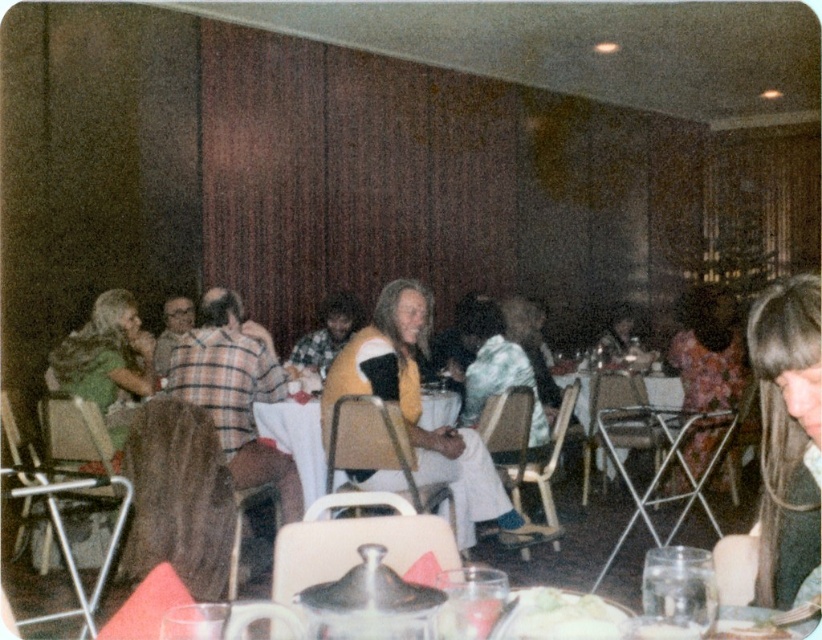
You are a guest at the dinner party and want to place your napkin on the translucent glass bowl at center. Can you do this without moving any other items on the table?

The translucent glass bowl at center is located at point (469, 616), so yes, you can place your napkin on it without disturbing other items as long as there is space available on the bowl itself.

You are a photographer at the event and want to capture a photo of both the yellow sweater at center and the floral dress at center. Since you want to highlight both equally, which one should you zoom in on more to ensure they appear the same size in the photo?

The yellow sweater at center is larger in size than the floral dress at center, so you should zoom in more on the floral dress at center to make them appear the same size in the photo.